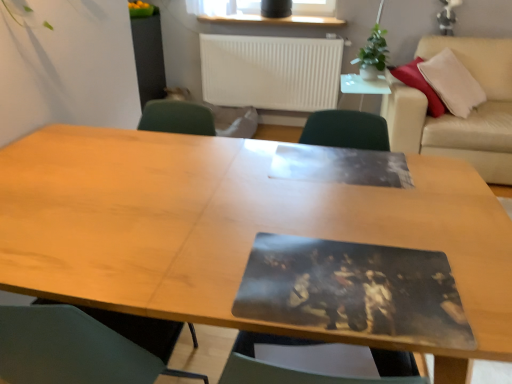
Question: Considering the relative sizes of white glossy side table at upper center and green leafy plant at upper right in the image provided, is white glossy side table at upper center shorter than green leafy plant at upper right?

Choices:
 (A) yes
 (B) no

Answer: (A)

Question: Is white glossy side table at upper center wider than green leafy plant at upper right?

Choices:
 (A) yes
 (B) no

Answer: (A)

Question: Is white glossy side table at upper center to the left of green leafy plant at upper right from the viewer's perspective?

Choices:
 (A) no
 (B) yes

Answer: (B)

Question: Is white glossy side table at upper center thinner than green leafy plant at upper right?

Choices:
 (A) no
 (B) yes

Answer: (A)

Question: Considering the relative positions of white glossy side table at upper center and green leafy plant at upper right in the image provided, is white glossy side table at upper center behind green leafy plant at upper right?

Choices:
 (A) yes
 (B) no

Answer: (B)

Question: From a real-world perspective, relative to wooden table at center, is white glossy side table at upper center vertically above or below?

Choices:
 (A) below
 (B) above

Answer: (B)

Question: Is white glossy side table at upper center situated inside wooden table at center or outside?

Choices:
 (A) outside
 (B) inside

Answer: (A)

Question: Considering the positions of white glossy side table at upper center and wooden table at center in the image, is white glossy side table at upper center taller or shorter than wooden table at center?

Choices:
 (A) tall
 (B) short

Answer: (B)

Question: Is white glossy side table at upper center bigger or smaller than wooden table at center?

Choices:
 (A) big
 (B) small

Answer: (B)

Question: From the image's perspective, relative to green leafy plant at upper right, is wooden table at center above or below?

Choices:
 (A) above
 (B) below

Answer: (B)

Question: Based on their sizes in the image, would you say wooden table at center is bigger or smaller than green leafy plant at upper right?

Choices:
 (A) small
 (B) big

Answer: (B)

Question: In terms of width, does wooden table at center look wider or thinner when compared to green leafy plant at upper right?

Choices:
 (A) thin
 (B) wide

Answer: (B)

Question: Which is correct: wooden table at center is inside green leafy plant at upper right, or outside of it?

Choices:
 (A) inside
 (B) outside

Answer: (B)

Question: Is point (509, 107) closer or farther from the camera than point (251, 61)?

Choices:
 (A) farther
 (B) closer

Answer: (B)

Question: From the image's perspective, is beige leather couch at upper right positioned above or below white matte radiator at upper center?

Choices:
 (A) below
 (B) above

Answer: (A)